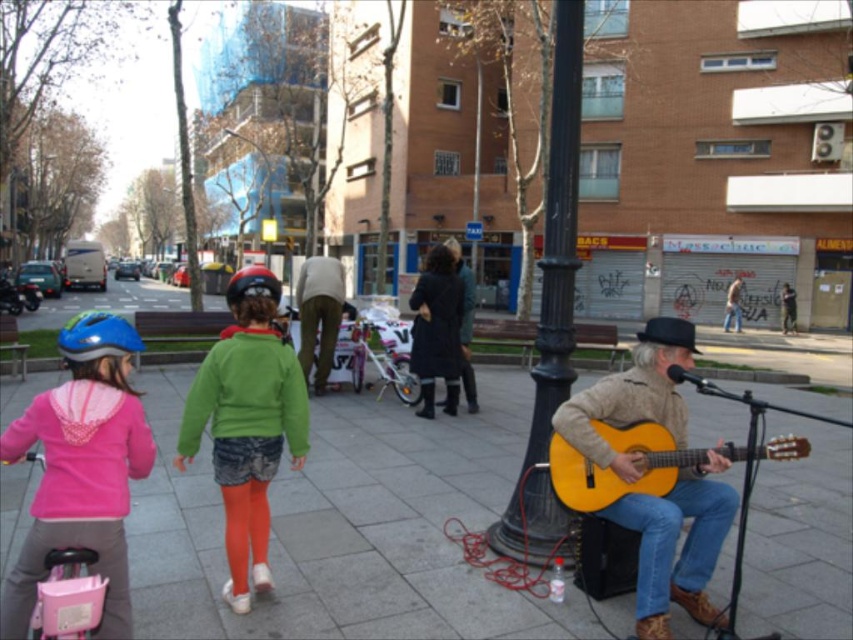
Who is more forward, (74, 376) or (254, 369)?

Point (74, 376) is more forward.

Is point (50, 486) farther from viewer compared to point (260, 461)?

No, (50, 486) is closer to viewer.

This screenshot has height=640, width=853. Find the location of `pink fleece jacket at lower left`. pink fleece jacket at lower left is located at coordinates (82, 467).

Is pink fleece jacket at lower left bigger than black metal pole at center?

Actually, pink fleece jacket at lower left might be smaller than black metal pole at center.

Is the position of pink fleece jacket at lower left more distant than that of black metal pole at center?

No, pink fleece jacket at lower left is in front of black metal pole at center.

Is point (25, 420) closer to viewer compared to point (564, 524)?

Yes, it is in front of point (564, 524).

Image resolution: width=853 pixels, height=640 pixels. In order to click on pink fleece jacket at lower left in this screenshot , I will do `click(82, 467)`.

Does black metal pole at center have a lesser height compared to blue matte bicycle helmet at left?

Incorrect, black metal pole at center's height does not fall short of blue matte bicycle helmet at left's.

Who is taller, black metal pole at center or blue matte bicycle helmet at left?

black metal pole at center is taller.

I want to click on black metal pole at center, so click(x=558, y=230).

I want to click on black metal pole at center, so click(x=558, y=230).